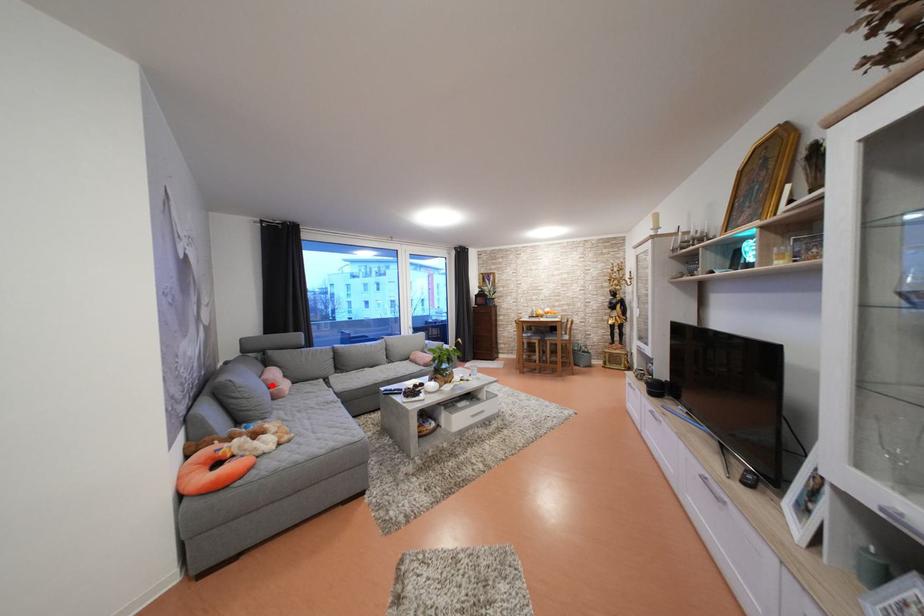
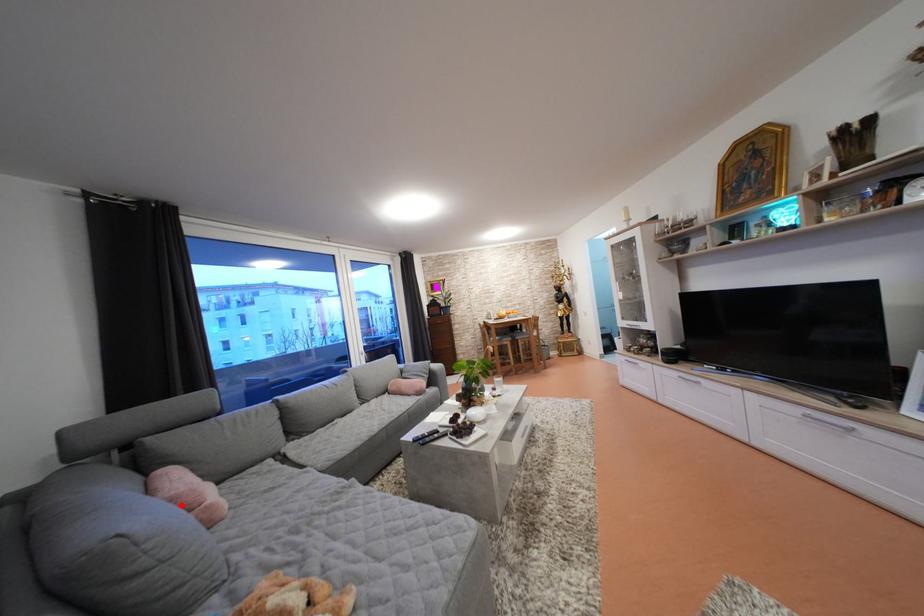
I am providing you with two images of the same scene from different viewpoints. A red point is marked on the first image and another point is marked on the second image. Is the red point in image1 aligned with the point shown in image2?

Yes